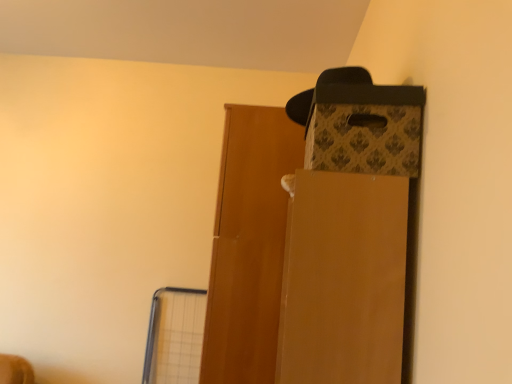
This screenshot has width=512, height=384. What do you see at coordinates (343, 279) in the screenshot? I see `matte brown cardboard box at upper right` at bounding box center [343, 279].

In order to face patterned cardboard box at upper right, should I rotate leftwards or rightwards?

Turn right approximately 13.080 degrees to face it.

This screenshot has width=512, height=384. What do you see at coordinates (249, 245) in the screenshot? I see `wooden door at center` at bounding box center [249, 245].

Where is `matte brown cardboard box at upper right`? matte brown cardboard box at upper right is located at coordinates (343, 279).

Is patterned cardboard box at upper right wider than matte brown cardboard box at upper right?

No, patterned cardboard box at upper right is not wider than matte brown cardboard box at upper right.

Consider the image. Between patterned cardboard box at upper right and matte brown cardboard box at upper right, which one has less height?

patterned cardboard box at upper right.

From a real-world perspective, is patterned cardboard box at upper right positioned above or below matte brown cardboard box at upper right?

Clearly, from a real-world perspective, patterned cardboard box at upper right is above matte brown cardboard box at upper right.

Based on the photo, which is in front, matte brown cardboard box at upper right or wooden door at center?

matte brown cardboard box at upper right is closer to the camera.

From a real-world perspective, is matte brown cardboard box at upper right physically located above or below wooden door at center?

Clearly, from a real-world perspective, matte brown cardboard box at upper right is below wooden door at center.

Between wooden door at center and patterned cardboard box at upper right, which one has smaller width?

With smaller width is patterned cardboard box at upper right.

Considering the relative sizes of wooden door at center and patterned cardboard box at upper right in the image provided, is wooden door at center taller than patterned cardboard box at upper right?

Indeed, wooden door at center has a greater height compared to patterned cardboard box at upper right.

From the image's perspective, is wooden door at center located beneath patterned cardboard box at upper right?

Correct, wooden door at center appears lower than patterned cardboard box at upper right in the image.

From a real-world perspective, is wooden door at center on top of patterned cardboard box at upper right?

No.

Is wooden door at center positioned with its back to matte brown cardboard box at upper right?

No.

From the picture: From the image's perspective, which one is positioned lower, wooden door at center or matte brown cardboard box at upper right?

wooden door at center appears lower in the image.

Between point (267, 110) and point (302, 364), which one is positioned in front?

Positioned in front is point (302, 364).

Is wooden door at center to the right of matte brown cardboard box at upper right from the viewer's perspective?

No.

Is patterned cardboard box at upper right facing away from wooden door at center?

No, patterned cardboard box at upper right's orientation is not away from wooden door at center.

From a real-world perspective, between patterned cardboard box at upper right and wooden door at center, who is vertically higher?

patterned cardboard box at upper right.

The image size is (512, 384). What are the coordinates of `storage box located above the wooden door at center (from a real-world perspective)` in the screenshot? It's located at (365, 129).

Which object is closer to the camera, patterned cardboard box at upper right or wooden door at center?

patterned cardboard box at upper right is more forward.

I want to click on cardboard box on the left of patterned cardboard box at upper right, so click(x=343, y=279).

Looking at this image, do you think matte brown cardboard box at upper right is within patterned cardboard box at upper right, or outside of it?

matte brown cardboard box at upper right is spatially situated outside patterned cardboard box at upper right.

Does matte brown cardboard box at upper right have a lesser height compared to patterned cardboard box at upper right?

No, matte brown cardboard box at upper right is not shorter than patterned cardboard box at upper right.

Would you say matte brown cardboard box at upper right is a long distance from patterned cardboard box at upper right?

No, matte brown cardboard box at upper right is not far from patterned cardboard box at upper right.

You are a GUI agent. You are given a task and a screenshot of the screen. Output one action in this format:
    pyautogui.click(x=<x>, y=<y>)
    Task: Click on the storage box located above the matte brown cardboard box at upper right (from the image's perspective)
    The image size is (512, 384).
    Given the screenshot: What is the action you would take?
    pyautogui.click(x=365, y=129)

Identify the location of door located on the left of matte brown cardboard box at upper right. Image resolution: width=512 pixels, height=384 pixels. point(249,245).

Based on their spatial positions, is wooden door at center or matte brown cardboard box at upper right further from patterned cardboard box at upper right?

Among the two, wooden door at center is located further to patterned cardboard box at upper right.

From the image, which object appears to be farther from matte brown cardboard box at upper right, wooden door at center or patterned cardboard box at upper right?

The object further to matte brown cardboard box at upper right is wooden door at center.

Considering their positions, is patterned cardboard box at upper right positioned closer to matte brown cardboard box at upper right than wooden door at center?

patterned cardboard box at upper right is positioned closer to the anchor matte brown cardboard box at upper right.

Based on their spatial positions, is matte brown cardboard box at upper right or wooden door at center further from patterned cardboard box at upper right?

wooden door at center lies further to patterned cardboard box at upper right than the other object.

Looking at the image, which one is located closer to wooden door at center, matte brown cardboard box at upper right or patterned cardboard box at upper right?

patterned cardboard box at upper right is positioned closer to the anchor wooden door at center.

From the picture: Which object lies further to the anchor point wooden door at center, patterned cardboard box at upper right or matte brown cardboard box at upper right?

matte brown cardboard box at upper right is positioned further to the anchor wooden door at center.

At what (x,y) coordinates should I click in order to perform the action: click on storage box between matte brown cardboard box at upper right and wooden door at center along the z-axis. Please return your answer as a coordinate pair (x, y). The width and height of the screenshot is (512, 384). Looking at the image, I should click on pyautogui.click(x=365, y=129).